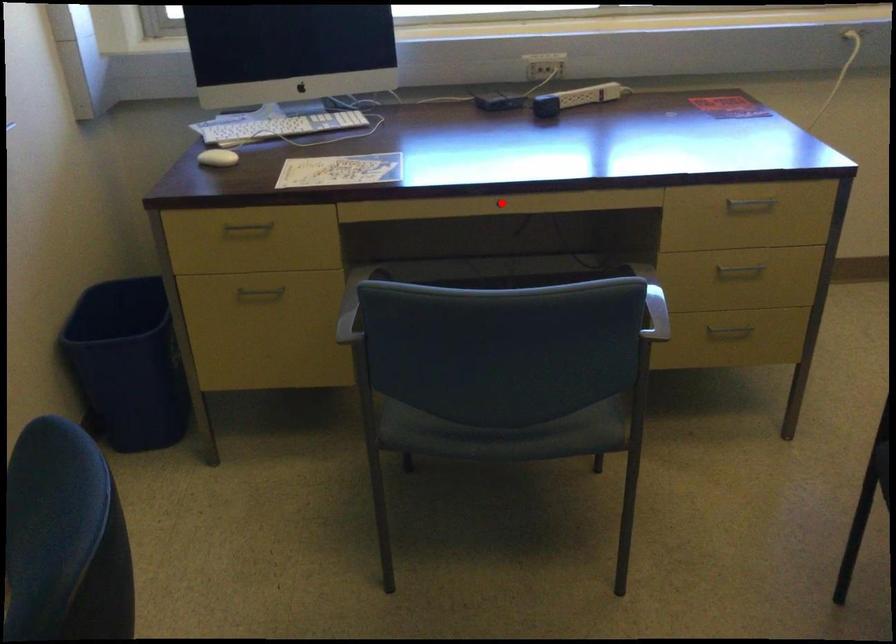
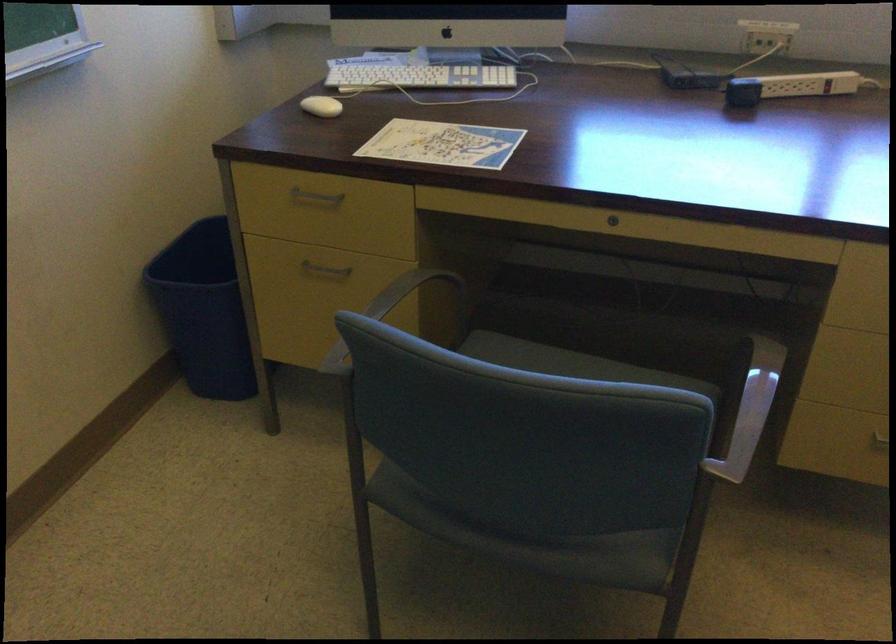
Where in the second image is the point corresponding to the highlighted location from the first image?

(613, 220)